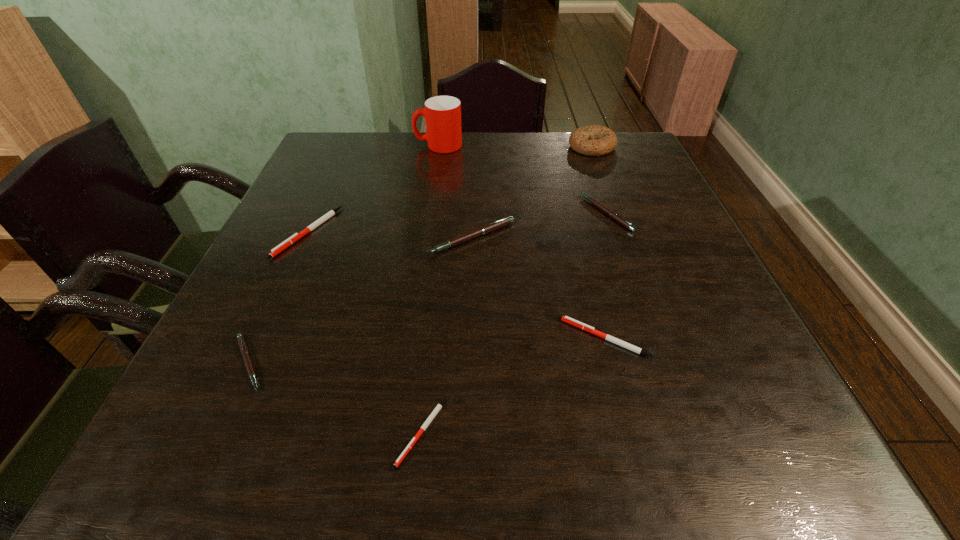
At what (x,y) coordinates should I click in order to perform the action: click on the tallest object. Please return your answer as a coordinate pair (x, y). Looking at the image, I should click on (442, 114).

The height and width of the screenshot is (540, 960). In order to click on red cup in this screenshot , I will do `click(442, 114)`.

Locate an element on the screen. The image size is (960, 540). the seventh shortest object is located at coordinates (594, 140).

This screenshot has height=540, width=960. I want to click on bagel, so click(x=594, y=140).

I want to click on the biggest pink pen, so click(500, 223).

Find the location of a particular element. The width and height of the screenshot is (960, 540). the tallest pen is located at coordinates (500, 223).

Locate an element on the screen. the second smallest pink pen is located at coordinates (612, 214).

Locate an element on the screen. The width and height of the screenshot is (960, 540). the biggest white pen is located at coordinates (275, 251).

You are a GUI agent. You are given a task and a screenshot of the screen. Output one action in this format:
    pyautogui.click(x=<x>, y=<y>)
    Task: Click on the farthest white pen
    The height and width of the screenshot is (540, 960).
    Given the screenshot: What is the action you would take?
    pyautogui.click(x=275, y=251)

The width and height of the screenshot is (960, 540). What are the coordinates of `the leftmost pink pen` in the screenshot? It's located at (244, 351).